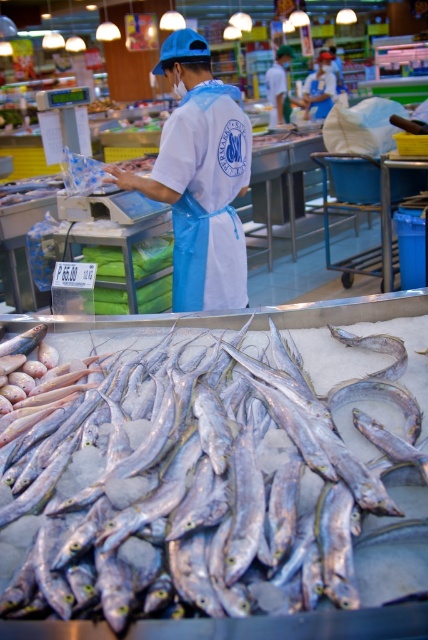
Based on the photo, is blue fabric apron at center smaller than blue apron at center?

Yes, blue fabric apron at center is smaller than blue apron at center.

Based on the photo, does blue fabric apron at center appear over blue apron at center?

Incorrect, blue fabric apron at center is not positioned above blue apron at center.

Which is in front, point (234, 129) or point (303, 88)?

Point (234, 129) is in front.

You are a GUI agent. You are given a task and a screenshot of the screen. Output one action in this format:
    pyautogui.click(x=<x>, y=<y>)
    Task: Click on the blue fabric apron at center
    This screenshot has height=640, width=428.
    Given the screenshot: What is the action you would take?
    click(201, 177)

What do you see at coordinates (216, 492) in the screenshot?
I see `silvery metallic fish at center` at bounding box center [216, 492].

Between silvery metallic fish at center and blue fabric apron at center, which one is positioned higher?

Result: blue fabric apron at center

Where is `silvery metallic fish at center`? silvery metallic fish at center is located at coordinates (216, 492).

Between silvery metallic fish at center and blue apron at center, which one is positioned higher?

blue apron at center

Does point (172, 564) lie behind point (315, 83)?

No, it is not.

Is point (12, 618) positioned before point (326, 93)?

Yes, it is.

Locate an element on the screen. The width and height of the screenshot is (428, 640). silvery metallic fish at center is located at coordinates (216, 492).